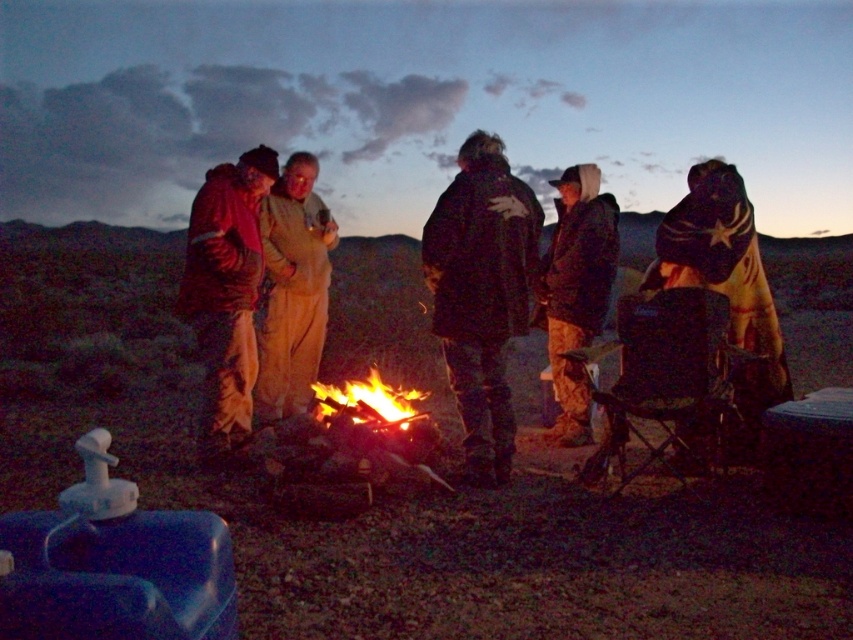
Question: Is camouflage pants at center to the left of flaming wood at center from the viewer's perspective?

Choices:
 (A) no
 (B) yes

Answer: (A)

Question: Does red fleece jacket at center have a larger size compared to camouflage pants at center?

Choices:
 (A) yes
 (B) no

Answer: (B)

Question: Is the position of light brown fabric jacket at center less distant than that of flaming wood at center?

Choices:
 (A) no
 (B) yes

Answer: (A)

Question: Which object is positioned closest to the light brown fabric jacket at center?

Choices:
 (A) red fleece jacket at center
 (B) flaming wood at center
 (C) dark brown leather jacket at center
 (D) camouflage pants at center

Answer: (A)

Question: Which point is farther to the camera?

Choices:
 (A) (215, 246)
 (B) (564, 260)
 (C) (325, 282)
 (D) (373, 397)

Answer: (C)

Question: Among these points, which one is farthest from the camera?

Choices:
 (A) (540, 224)
 (B) (573, 289)
 (C) (250, 188)
 (D) (316, 342)

Answer: (D)